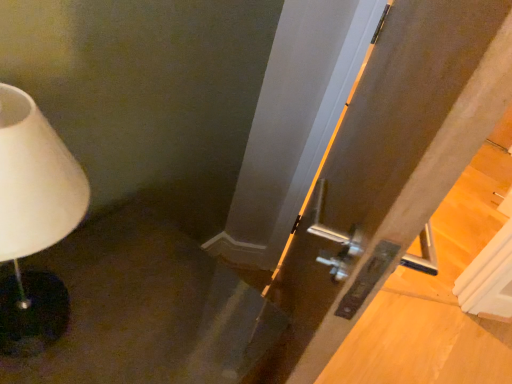
Question: Is metallic silver door at center outside of white matte lamp at left?

Choices:
 (A) no
 (B) yes

Answer: (B)

Question: Can you confirm if metallic silver door at center is thinner than white matte lamp at left?

Choices:
 (A) yes
 (B) no

Answer: (A)

Question: Considering the relative sizes of metallic silver door at center and white matte lamp at left in the image provided, is metallic silver door at center bigger than white matte lamp at left?

Choices:
 (A) yes
 (B) no

Answer: (A)

Question: Does metallic silver door at center come in front of white matte lamp at left?

Choices:
 (A) no
 (B) yes

Answer: (B)

Question: From the image's perspective, would you say metallic silver door at center is shown under white matte lamp at left?

Choices:
 (A) no
 (B) yes

Answer: (B)

Question: Is the position of metallic silver door at center more distant than that of white matte lamp at left?

Choices:
 (A) yes
 (B) no

Answer: (B)

Question: Is white matte lamp at left to the right of metallic silver door at center from the viewer's perspective?

Choices:
 (A) yes
 (B) no

Answer: (B)

Question: Is white matte lamp at left oriented away from metallic silver door at center?

Choices:
 (A) yes
 (B) no

Answer: (B)

Question: Can you confirm if white matte lamp at left is taller than metallic silver door at center?

Choices:
 (A) no
 (B) yes

Answer: (A)

Question: Considering the relative sizes of white matte lamp at left and metallic silver door at center in the image provided, is white matte lamp at left smaller than metallic silver door at center?

Choices:
 (A) no
 (B) yes

Answer: (B)

Question: Could you tell me if white matte lamp at left is facing metallic silver door at center?

Choices:
 (A) no
 (B) yes

Answer: (A)

Question: Does white matte lamp at left have a lesser width compared to metallic silver door at center?

Choices:
 (A) yes
 (B) no

Answer: (B)

Question: From a real-world perspective, is metallic silver door at center positioned above or below white matte lamp at left?

Choices:
 (A) below
 (B) above

Answer: (A)